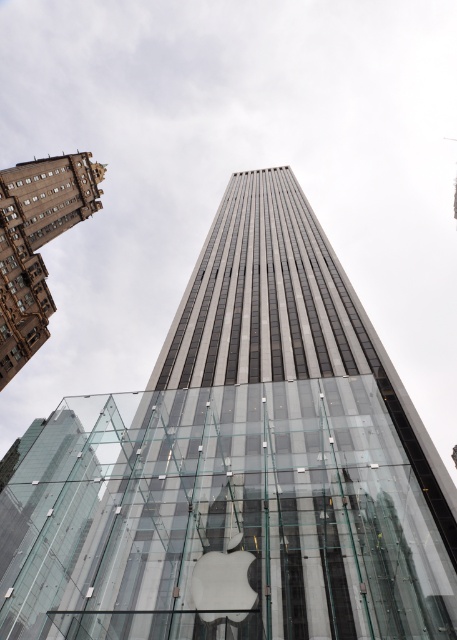
You are standing in front of the modern skyscraper and want to determine the relative positions of two points marked on the building. The first point is at coordinates point (312, 368) and the second is at point (53, 305). Which point is closer to you?

Point (312, 368) is closer to the viewer than point (53, 305).

You are a city planner assessing the skyline. Given the glassy steel tower at center and the brown stone building at upper left, which one would occupy more horizontal space in the city layout?

The glassy steel tower at center has a larger width than the brown stone building at upper left, so it occupies more horizontal space in the city layout.

You are standing in front of the modern architectural scene with the tall skyscraper and the traditional building to its left. There is a point at coordinates point (267,458). Which building does this point belong to?

The point (267,458) is on the glassy steel tower at center.